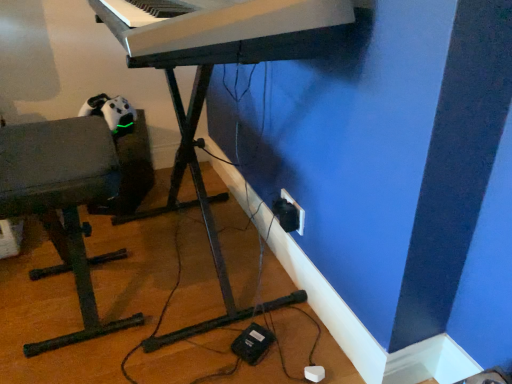
Question: From the image's perspective, is white plastic keyboard at upper center over black plastic plug at lower right?

Choices:
 (A) no
 (B) yes

Answer: (B)

Question: Does white plastic keyboard at upper center turn towards black plastic plug at lower right?

Choices:
 (A) yes
 (B) no

Answer: (B)

Question: Considering the relative sizes of white plastic keyboard at upper center and black plastic plug at lower right in the image provided, is white plastic keyboard at upper center bigger than black plastic plug at lower right?

Choices:
 (A) no
 (B) yes

Answer: (B)

Question: From the image's perspective, would you say white plastic keyboard at upper center is shown under black plastic plug at lower right?

Choices:
 (A) no
 (B) yes

Answer: (A)

Question: Does white plastic keyboard at upper center appear on the right side of black plastic plug at lower right?

Choices:
 (A) yes
 (B) no

Answer: (B)

Question: Does white plastic keyboard at upper center appear on the left side of black plastic plug at lower right?

Choices:
 (A) no
 (B) yes

Answer: (B)

Question: Is matte gray bench at left smaller than white plastic keyboard at upper center?

Choices:
 (A) no
 (B) yes

Answer: (A)

Question: Is matte gray bench at left outside white plastic keyboard at upper center?

Choices:
 (A) no
 (B) yes

Answer: (B)

Question: Is matte gray bench at left turned away from white plastic keyboard at upper center?

Choices:
 (A) no
 (B) yes

Answer: (A)

Question: Does matte gray bench at left have a larger size compared to white plastic keyboard at upper center?

Choices:
 (A) yes
 (B) no

Answer: (A)

Question: Does matte gray bench at left come behind white plastic keyboard at upper center?

Choices:
 (A) no
 (B) yes

Answer: (B)

Question: Can you confirm if matte gray bench at left is thinner than white plastic keyboard at upper center?

Choices:
 (A) yes
 (B) no

Answer: (A)

Question: From the image's perspective, is black plastic electric outlet at lower right located above black plastic plug at lower right?

Choices:
 (A) no
 (B) yes

Answer: (B)